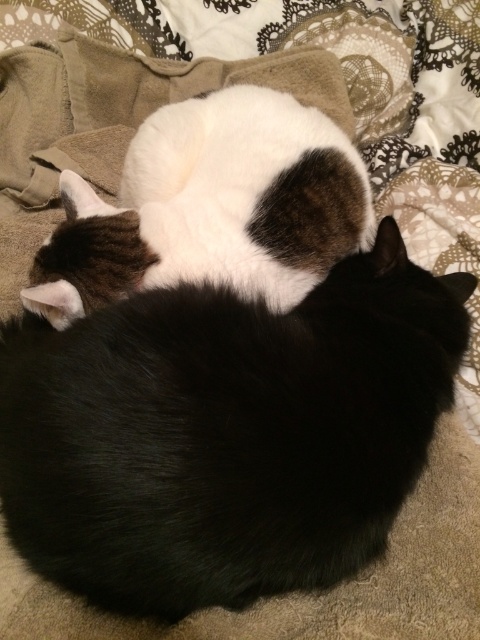
You are a photographer trying to capture a clear shot of both cats. You notice two specific points in the image labeled as point 1 and point 2. Point 1 is at coordinate (180, 406) and point 2 is at coordinate (54, 284). Since you want to focus on the cat that is closer to the camera, which point should you adjust your camera focus to?

Point 1 at coordinate (180, 406) is in front of point 2 at coordinate (54, 284), so you should focus on point 1 to capture the cat closer to the camera.

You are a photographer trying to capture both cats in the image. Since the black fur cat at center is blocking part of the white fur cat at center, which cat should you adjust your camera angle to focus on first to ensure both are visible?

The black fur cat at center is much taller than the white fur cat at center, so you should adjust your camera angle to focus on the taller black fur cat at center first to ensure the shorter white fur cat at center is not fully obscured.